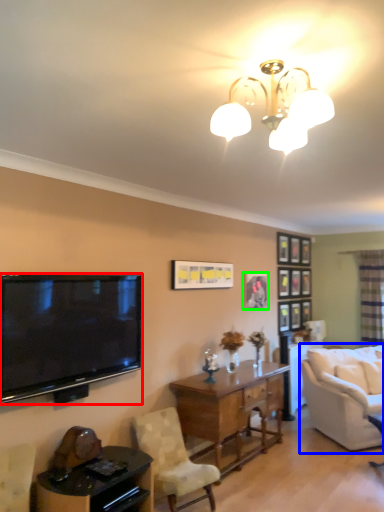
Question: Which object is the farthest from television (highlighted by a red box)? Choose among these: studio couch (highlighted by a blue box) or picture frame (highlighted by a green box).

Choices:
 (A) studio couch
 (B) picture frame

Answer: (A)